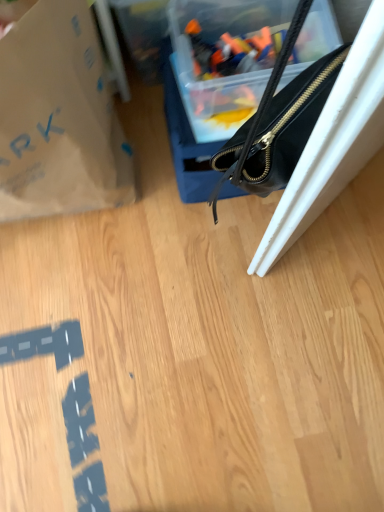
Question: Which is correct: black leather handbag at upper right is inside brown paper bag at upper left, or outside of it?

Choices:
 (A) outside
 (B) inside

Answer: (A)

Question: From a real-world perspective, is black leather handbag at upper right physically located above or below brown paper bag at upper left?

Choices:
 (A) above
 (B) below

Answer: (B)

Question: Considering the positions of black leather handbag at upper right and brown paper bag at upper left in the image, is black leather handbag at upper right bigger or smaller than brown paper bag at upper left?

Choices:
 (A) small
 (B) big

Answer: (A)

Question: From a real-world perspective, is brown paper bag at upper left positioned above or below black leather handbag at upper right?

Choices:
 (A) below
 (B) above

Answer: (B)

Question: Considering the relative positions of brown paper bag at upper left and black leather handbag at upper right in the image provided, is brown paper bag at upper left to the left or to the right of black leather handbag at upper right?

Choices:
 (A) left
 (B) right

Answer: (A)

Question: In terms of width, does brown paper bag at upper left look wider or thinner when compared to black leather handbag at upper right?

Choices:
 (A) thin
 (B) wide

Answer: (A)

Question: Relative to black leather handbag at upper right, is brown paper bag at upper left in front or behind?

Choices:
 (A) front
 (B) behind

Answer: (A)